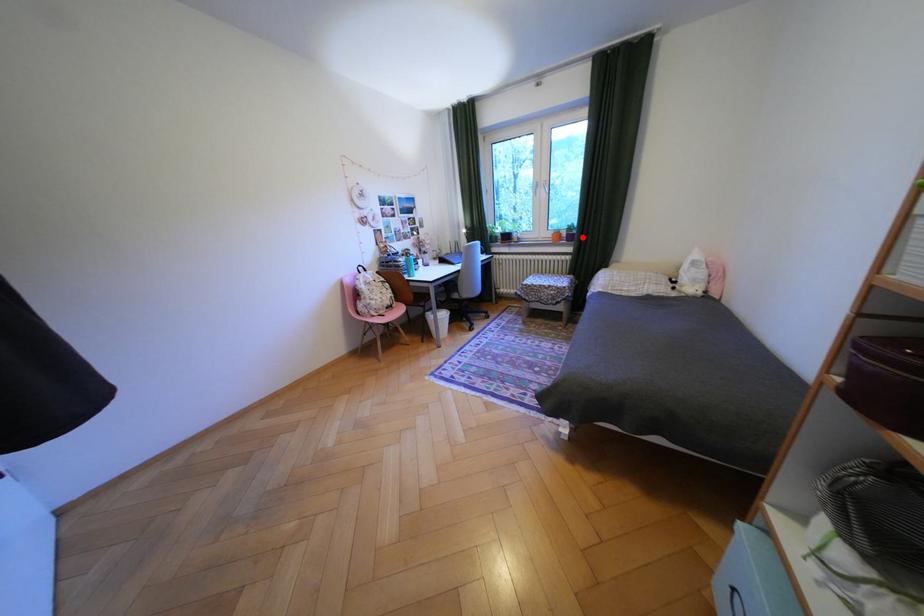
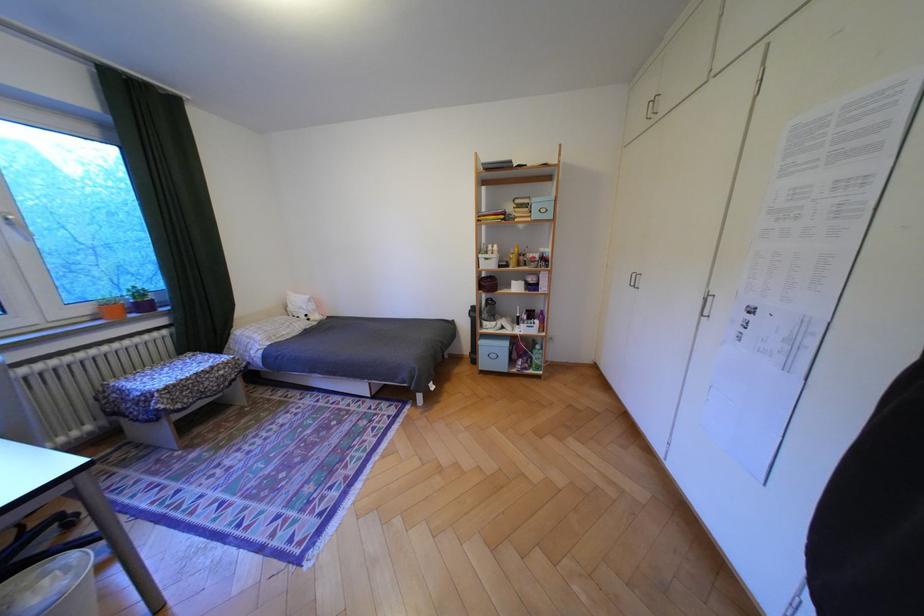
Question: I am providing you with two images of the same scene from different viewpoints. Image1 has a red point marked. In image2, the corresponding 3D location appears at what relative position? Reply with the corresponding letter.

Choices:
 (A) Closer
 (B) Farther

Answer: (B)